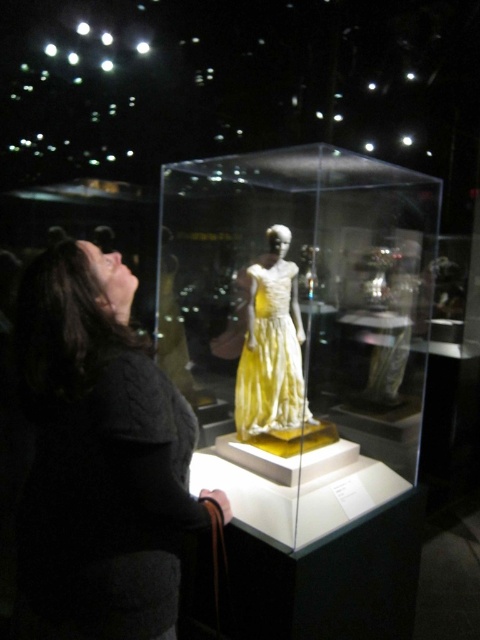
Can you confirm if transparent glass box at center is positioned to the left of dark gray sweater at lower left?

No, transparent glass box at center is not to the left of dark gray sweater at lower left.

Is point (380, 243) less distant than point (40, 548)?

No, (380, 243) is behind (40, 548).

This screenshot has width=480, height=640. Find the location of `transparent glass box at center`. transparent glass box at center is located at coordinates (299, 328).

Who is more forward, (333, 522) or (269, 376)?

Positioned in front is point (333, 522).

Does point (244, 276) come farther from viewer compared to point (256, 346)?

Yes.

Where is `transparent glass box at center`? This screenshot has width=480, height=640. transparent glass box at center is located at coordinates (299, 328).

Between dark gray sweater at lower left and yellow satin dress at center, which one has less height?

yellow satin dress at center is shorter.

Does dark gray sweater at lower left have a greater height compared to yellow satin dress at center?

Indeed, dark gray sweater at lower left has a greater height compared to yellow satin dress at center.

The image size is (480, 640). What do you see at coordinates (98, 458) in the screenshot? I see `dark gray sweater at lower left` at bounding box center [98, 458].

The image size is (480, 640). Identify the location of dark gray sweater at lower left. (98, 458).